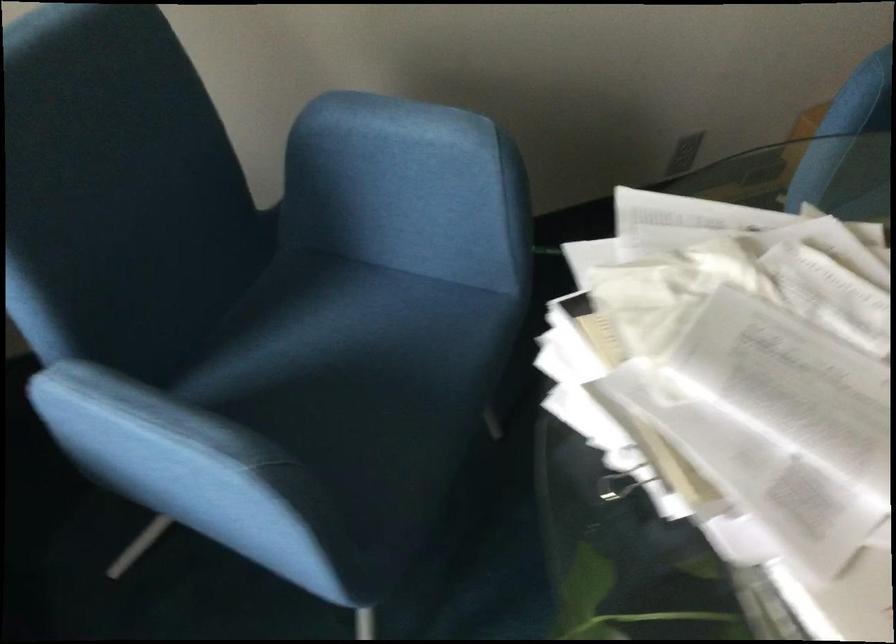
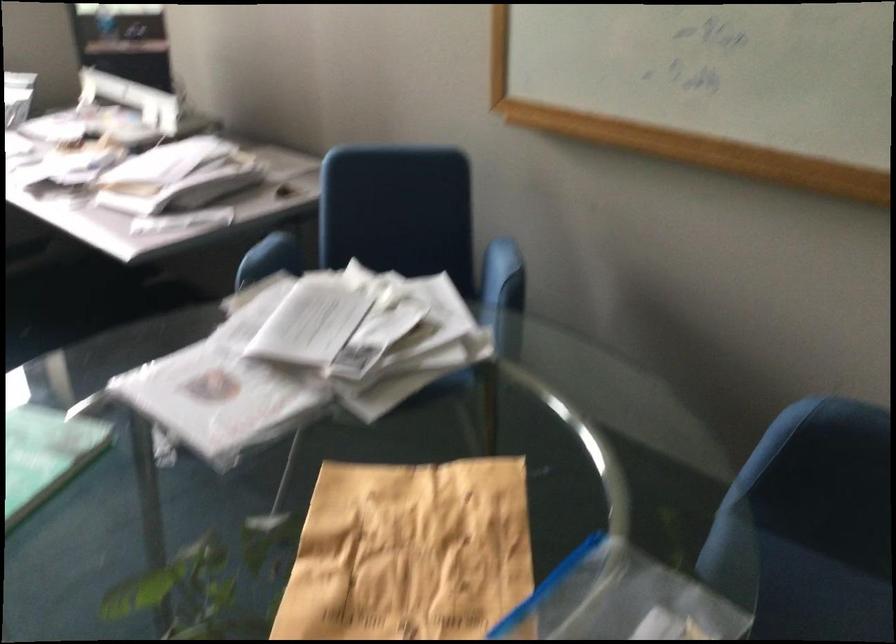
Locate, in the second image, the point that corresponds to (x=451, y=124) in the first image.

(498, 265)